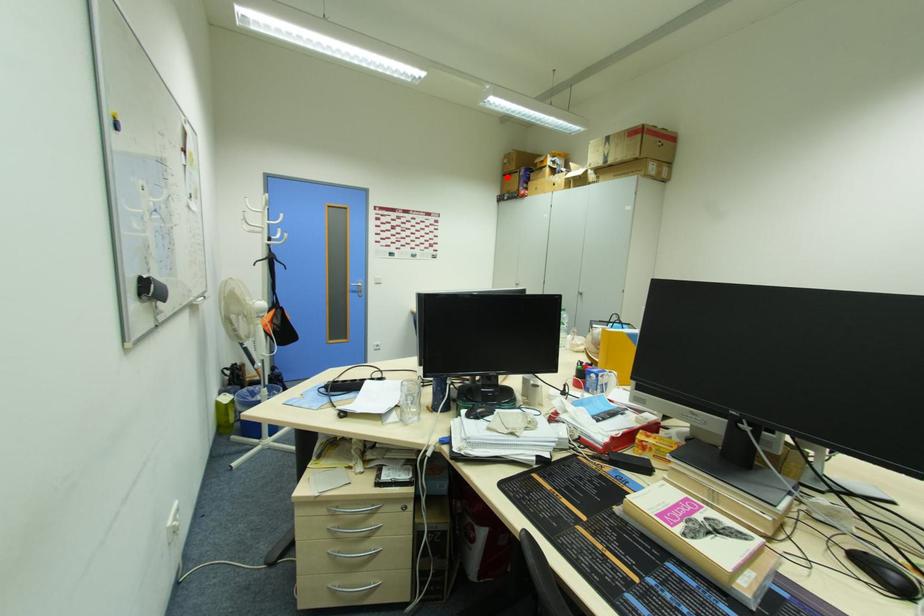
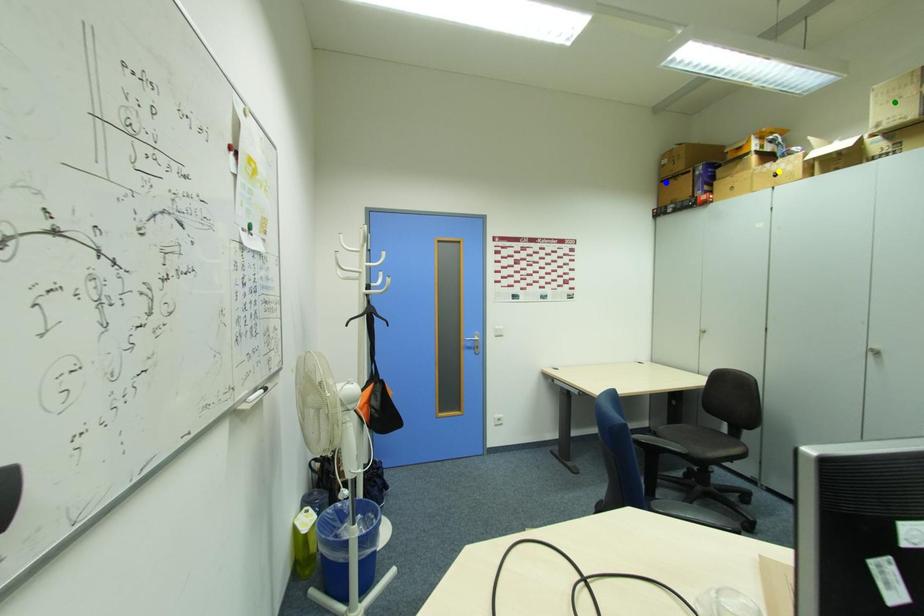
Question: I am providing you with two images of the same scene from different viewpoints. A red point is marked on the first image. You are given multiple points on the second image. Which mark in image 2 goes with the point in image 1?

Choices:
 (A) yellow point
 (B) green point
 (C) blue point

Answer: (C)